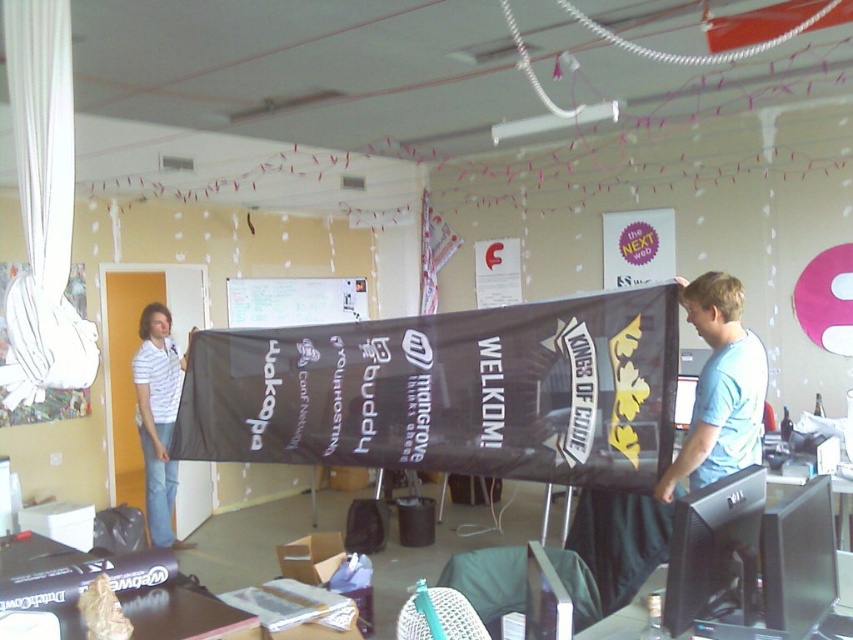
You are a photographer standing in the center of the room. You want to take a photo that includes both the black fabric banner at center and the white striped shirt at left. What is the minimum distance you need to move backward to ensure both objects are in frame?

The black fabric banner at center and the white striped shirt at left are 4.24 feet apart. To include both in the frame, you need to move backward until your camera can capture a field of view that accommodates at least 4.24 feet between them. The exact distance depends on your camera lens, but knowing the separation helps in positioning.

You are setting up a presentation in the office. You need to ensure the black glossy monitor at lower right is visible to the audience. Is the black fabric banner at center blocking the monitor?

The black glossy monitor at lower right is behind the black fabric banner at center, so the banner is blocking the monitor and making it invisible to the audience.